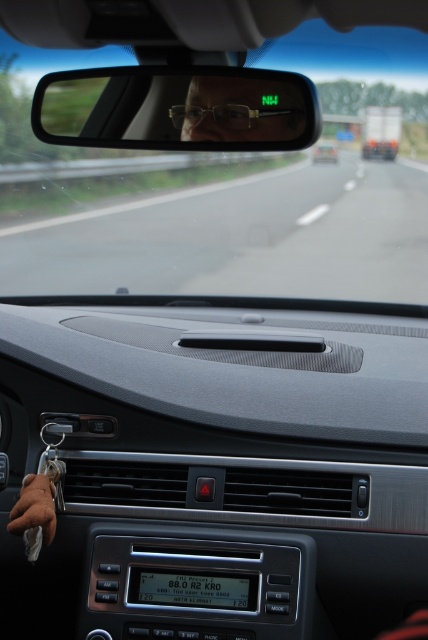
Question: Observing the image, what is the correct spatial positioning of transparent glass windshield at upper center in reference to matte black glasses at center?

Choices:
 (A) right
 (B) left

Answer: (B)

Question: Does transparent glass windshield at upper center have a larger size compared to matte black glasses at center?

Choices:
 (A) no
 (B) yes

Answer: (B)

Question: Among these objects, which one is nearest to the camera?

Choices:
 (A) matte black glasses at center
 (B) clear plastic mirror at center
 (C) transparent glass windshield at upper center

Answer: (C)

Question: Which point is farther from the camera taking this photo?

Choices:
 (A) (59, 232)
 (B) (187, 106)
 (C) (101, 77)

Answer: (A)

Question: Can you confirm if transparent glass windshield at upper center is positioned to the right of clear plastic mirror at center?

Choices:
 (A) yes
 (B) no

Answer: (B)

Question: Among these objects, which one is nearest to the camera?

Choices:
 (A) transparent glass windshield at upper center
 (B) matte black glasses at center

Answer: (A)